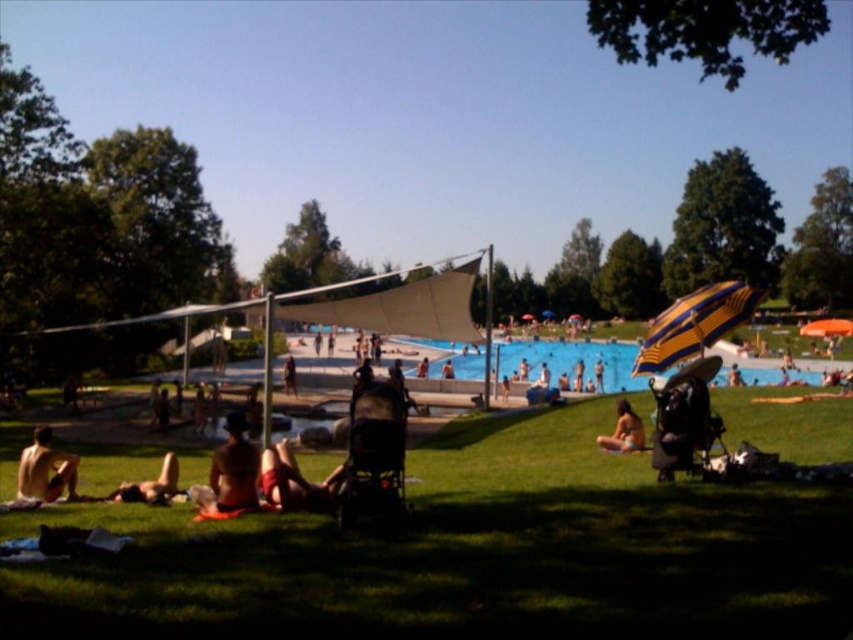
Which of these two, skinny bikini at lower left or tan skin person at center, stands taller?

With more height is tan skin person at center.

Can you confirm if skinny bikini at lower left is thinner than tan skin person at center?

Yes.

From the picture: Who is more forward, (152, 488) or (291, 385)?

Point (152, 488) is more forward.

Where is `skinny bikini at lower left`? skinny bikini at lower left is located at coordinates pyautogui.click(x=149, y=484).

Can you confirm if smooth skin person at center is positioned below skinny bikini at lower left?

Actually, smooth skin person at center is above skinny bikini at lower left.

Can you confirm if smooth skin person at center is thinner than skinny bikini at lower left?

Correct, smooth skin person at center's width is less than skinny bikini at lower left's.

The width and height of the screenshot is (853, 640). In order to click on smooth skin person at center in this screenshot , I will do `click(234, 468)`.

Does point (395, 582) come in front of point (21, 488)?

That is True.

Is point (36, 566) positioned after point (45, 448)?

That is False.

The image size is (853, 640). In order to click on green grass at lower center in this screenshot , I will do `click(469, 554)`.